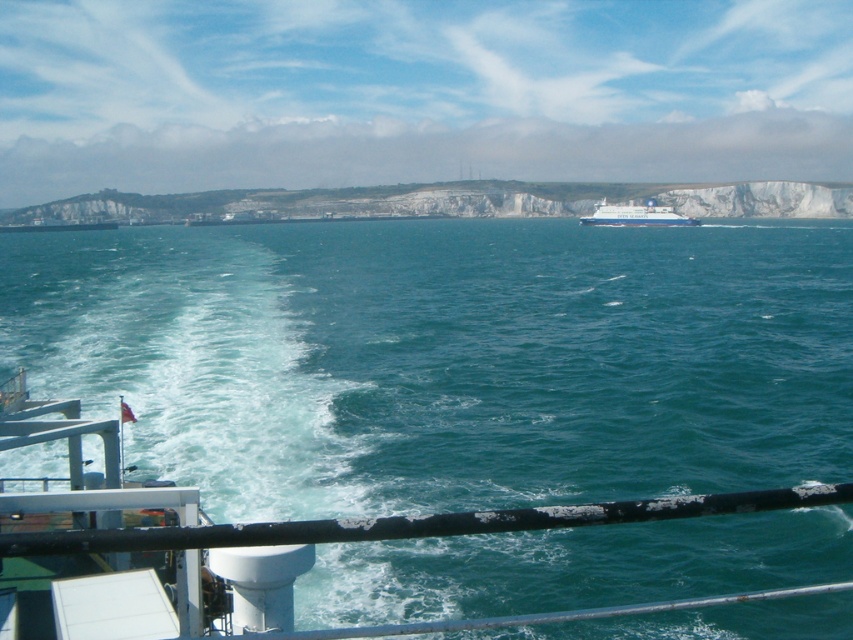
You are standing on the deck of the ship and looking out at the scene. Which object, the clear blue water at center or the white glossy cruise ship at center, appears taller from your vantage point?

The clear blue water at center appears taller than the white glossy cruise ship at center from your vantage point.

From the picture: You are standing on the deck of the ship and looking out at the scene. Which object, the clear blue water at center or the white glossy cruise ship at center, is positioned higher relative to your viewpoint?

The white glossy cruise ship at center is positioned higher than the clear blue water at center because the clear blue water at center is located below it.

You are standing on the ship deck and see the clear blue water at center and the white glossy cruise ship at center. Which object is positioned more to the right side from your viewpoint?

The white glossy cruise ship at center is positioned more to the right side than the clear blue water at center.